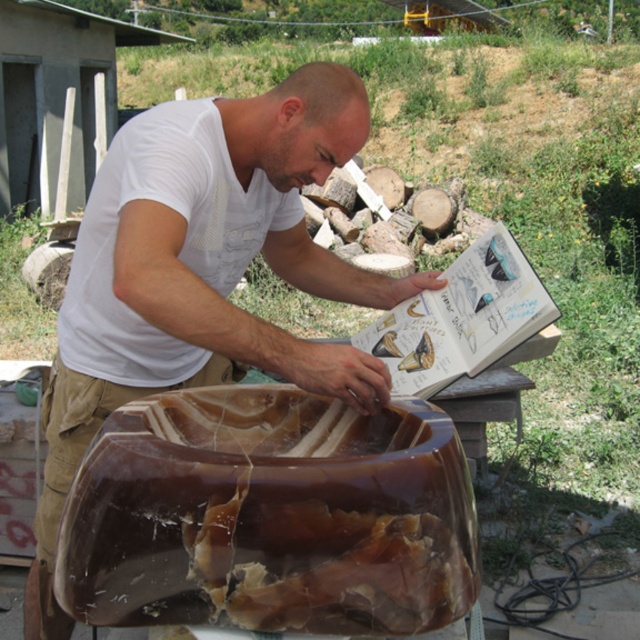
You are a delivery person who needs to place a fragile item on the table. The table has the translucent amber bowl at center and the brown leather belt at lower center. Which object should you avoid placing the item near to prevent it from falling off?

You should avoid placing the item near the brown leather belt at lower center because the translucent amber bowl at center is above it, meaning the belt is closer to the edge of the table.

You are an archaeologist examining the scene. The translucent amber bowl at center is crucial to your study. Based on its position relative to the man and the stone, can you determine if the bowl is placed on the stone or near the man?

The translucent amber bowl at center is located at point coordinates that place it at the center of the image. Since the man is focused on the stone and the bowl is centrally positioned, it is likely placed on the stone for reference during his work.